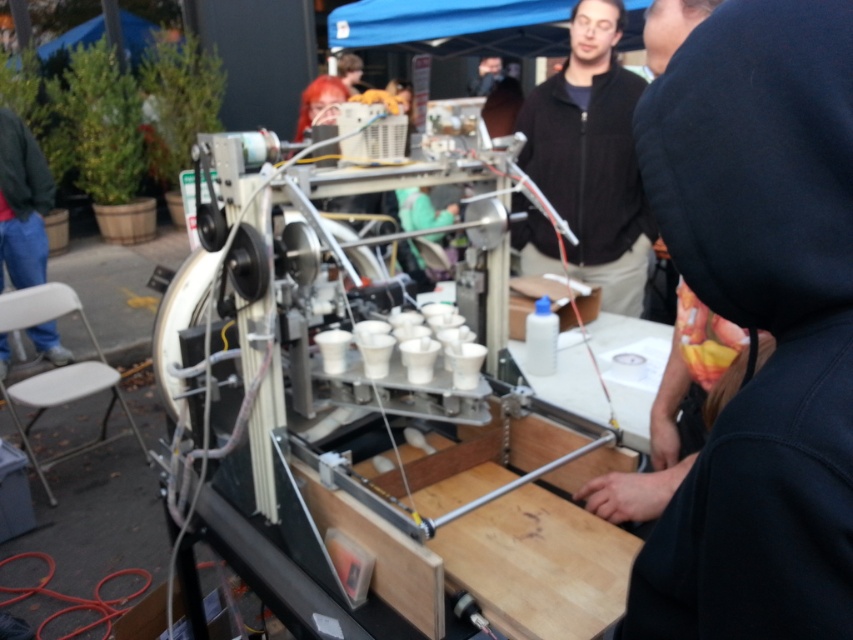
You are a person who is 5 feet tall and standing at the lower left corner of the image. You want to sit down on the white plastic chair at lower left without stepping on the blue jeans at lower left. Is there enough space between them for you to move freely?

The blue jeans at lower left and white plastic chair at lower left are 3.81 feet apart. Since you are 5 feet tall, the distance between them is sufficient for you to move freely without stepping on the blue jeans at lower left.

You are setting up a booth at the event. The blue fabric canopy at upper center needs to be secured to the booth structure. The blue jeans at lower left are part of your outfit. Which item requires a wider securing mechanism?

The blue fabric canopy at upper center requires a wider securing mechanism because its width is larger than the blue jeans at lower left.